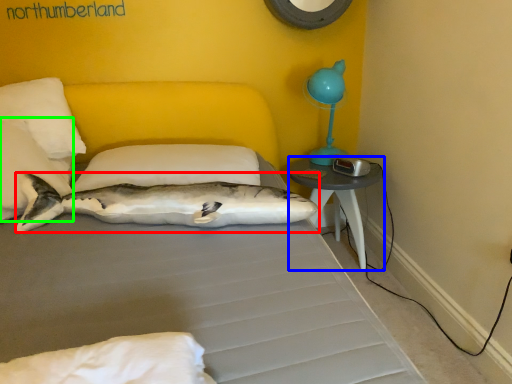
Question: Estimate the real-world distances between objects in this image. Which object is farther from shark (highlighted by a red box), nightstand (highlighted by a blue box) or pillow (highlighted by a green box)?

Choices:
 (A) nightstand
 (B) pillow

Answer: (A)